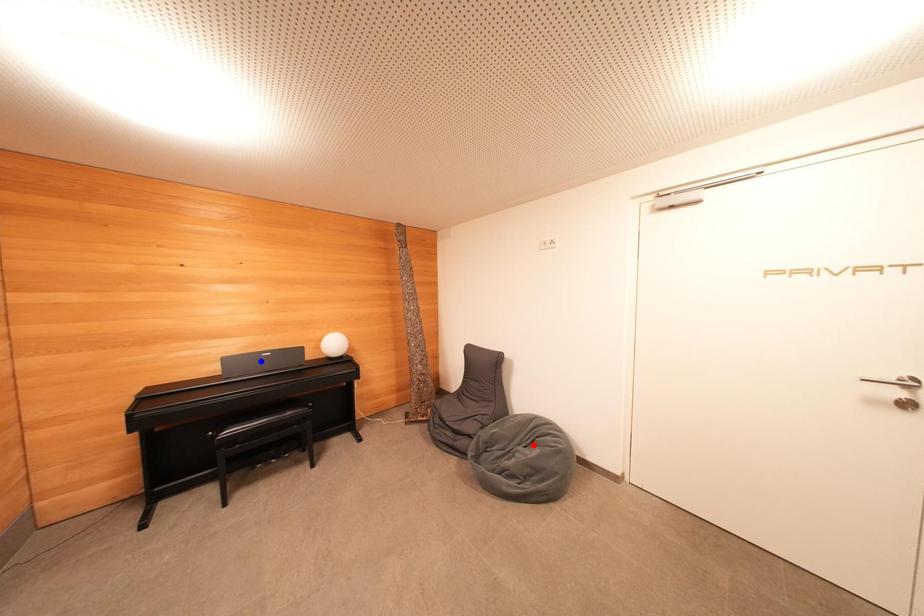
Question: Two points are marked on the image. Which point is closer to the camera?

Choices:
 (A) Blue point is closer.
 (B) Red point is closer.

Answer: (B)